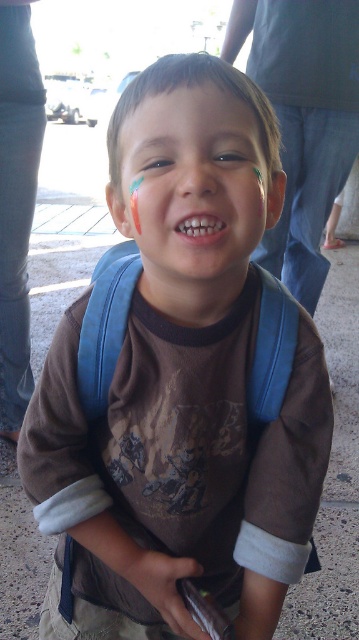
Is point (215, 154) farther from viewer compared to point (187, 220)?

Yes, point (215, 154) is behind point (187, 220).

From the picture: Is matte brown face at center wider than white glossy teeth at center?

Yes, matte brown face at center is wider than white glossy teeth at center.

Is point (267, 180) behind point (206, 227)?

Yes, point (267, 180) is farther from viewer.

Locate an element on the screen. matte brown face at center is located at coordinates (194, 189).

The width and height of the screenshot is (359, 640). Describe the element at coordinates (188, 88) in the screenshot. I see `matte skin forehead at center` at that location.

From the picture: Which is below, matte skin forehead at center or smooth skin nose at center?

smooth skin nose at center

Does point (234, 70) come closer to viewer compared to point (174, 182)?

That is False.

You are a GUI agent. You are given a task and a screenshot of the screen. Output one action in this format:
    pyautogui.click(x=<x>, y=<y>)
    Task: Click on the matte skin forehead at center
    
    Given the screenshot: What is the action you would take?
    point(188,88)

Is point (136, 122) closer to viewer compared to point (179, 84)?

No, it is not.

The width and height of the screenshot is (359, 640). Describe the element at coordinates (194, 189) in the screenshot. I see `matte brown face at center` at that location.

Where is `matte brown face at center`? The height and width of the screenshot is (640, 359). matte brown face at center is located at coordinates (194, 189).